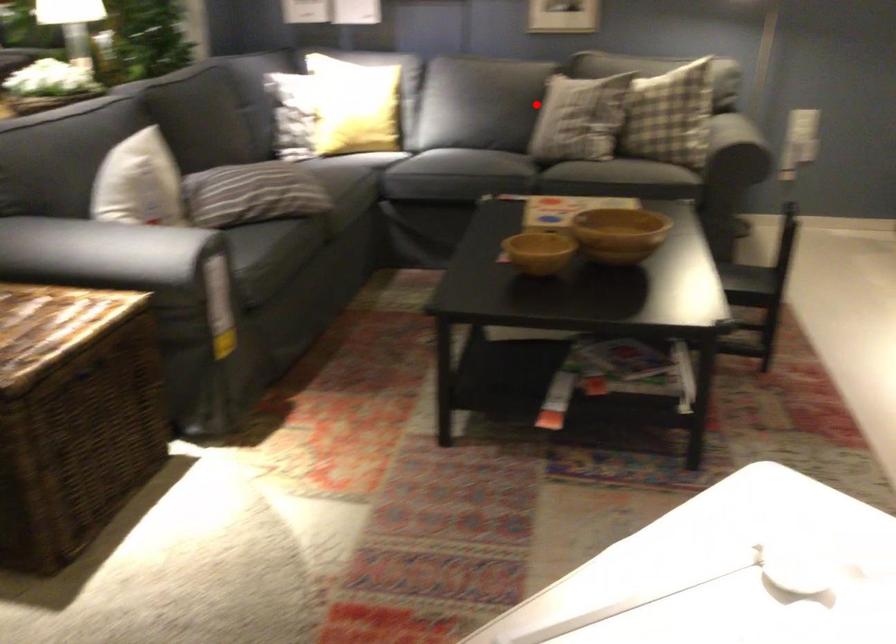
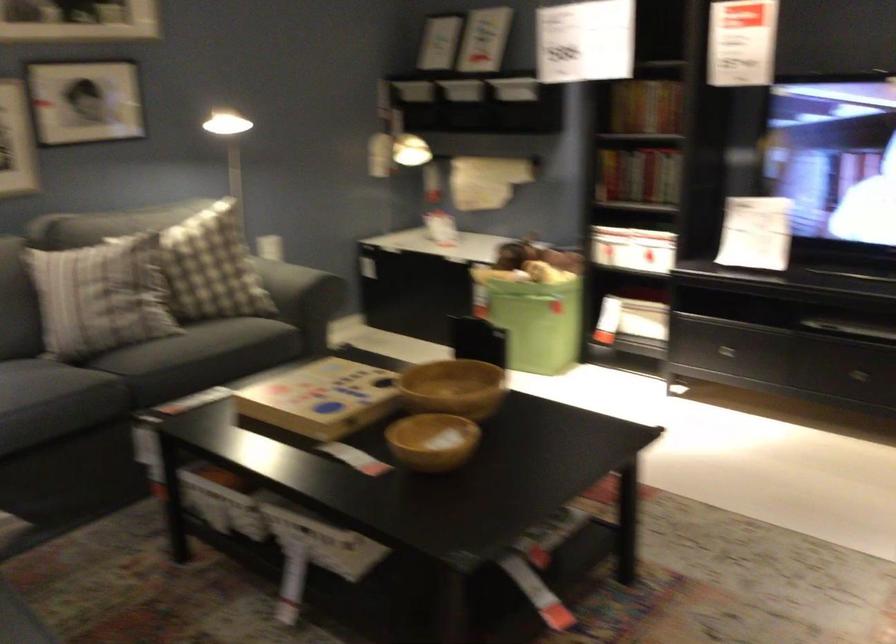
The point at the highlighted location is marked in the first image. Where is the corresponding point in the second image?

(99, 296)